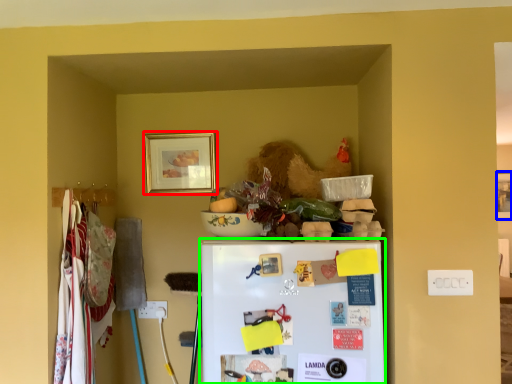
Question: Based on their relative distances, which object is farther from picture frame (highlighted by a red box)? Choose from picture frame (highlighted by a blue box) and refrigerator (highlighted by a green box).

Choices:
 (A) picture frame
 (B) refrigerator

Answer: (A)